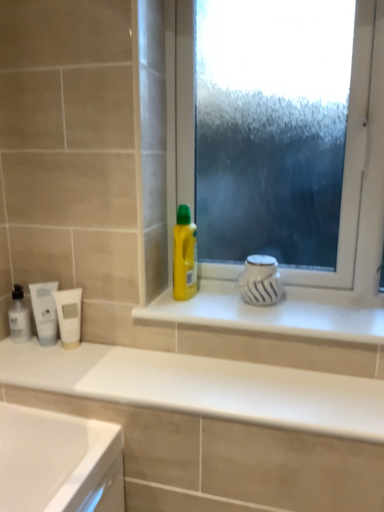
You are a GUI agent. You are given a task and a screenshot of the screen. Output one action in this format:
    pyautogui.click(x=<x>, y=<y>)
    Task: Click on the vacant area to the right of white glossy jar at center
    Image resolution: width=384 pixels, height=512 pixels.
    Given the screenshot: What is the action you would take?
    pyautogui.click(x=321, y=309)